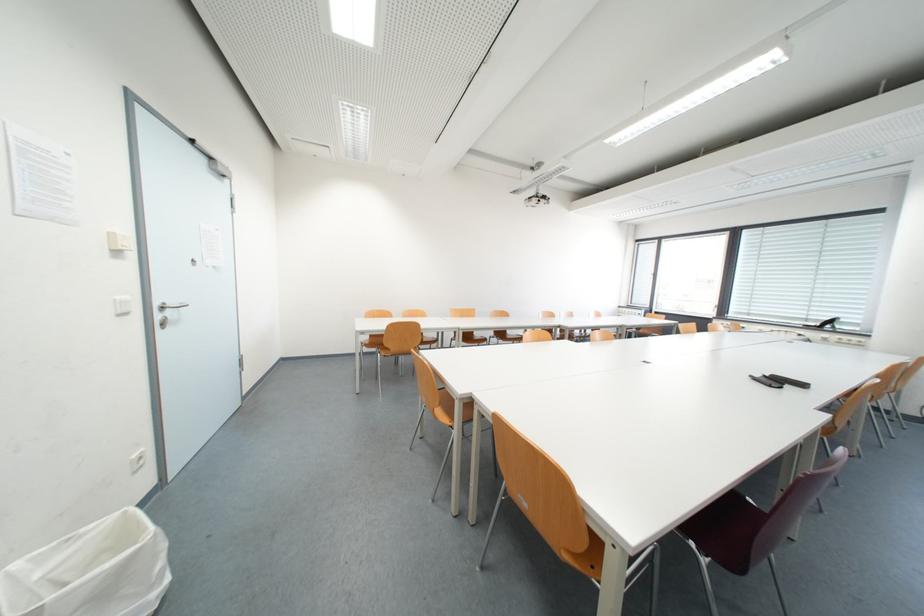
At what (x,y) coordinates should I click in order to perform the action: click on black window handle. Please return your answer as a coordinate pair (x, y). The image size is (924, 616). Looking at the image, I should click on (828, 323).